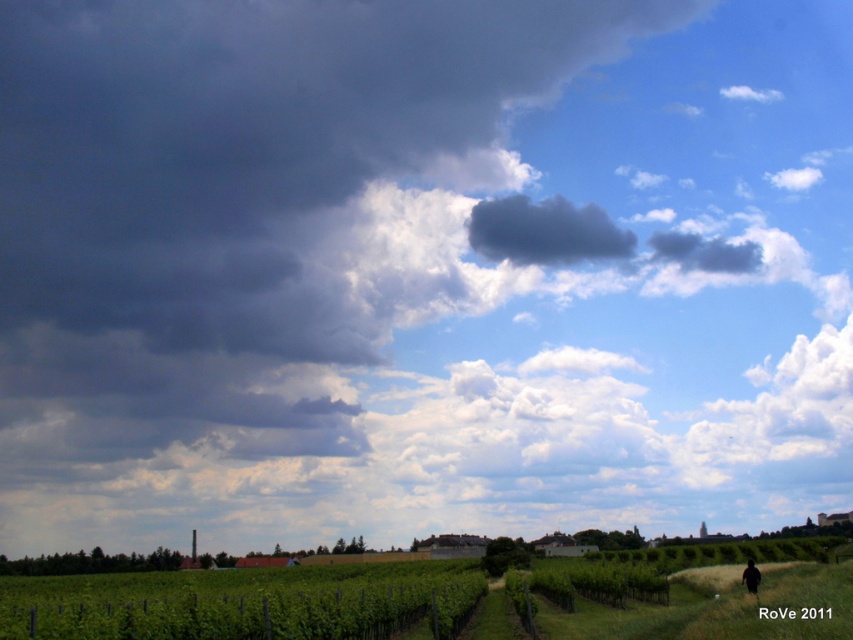
You are a photographer standing at the edge of the vineyard, looking towards the buildings. You want to capture a photo where the dark gray cloud at upper center and dark brown hair at lower right are both visible. Which object will appear larger in the photo?

The dark gray cloud at upper center will appear larger in the photo because it has a greater height compared to the dark brown hair at lower right.

You are a photographer planning to capture a landscape shot of the vineyard. You want to ensure both the dark gray cloud at upper center and the dark brown hair at lower right are in focus. Given that your camera has a depth of field that can cover 80 meters, will both elements be in focus?

The dark gray cloud at upper center and dark brown hair at lower right are 76.30 meters apart. Since the distance between them is within the camera depth of field range of 80 meters, both elements will be in focus.

You are standing at the origin point in the image and want to reach the point at the bottom right corner. Which of the two points, point (634, 243) or point (746, 586), is closer to your destination?

Point (746, 586) is closer to the bottom right corner destination because it is in front of point (634, 243).